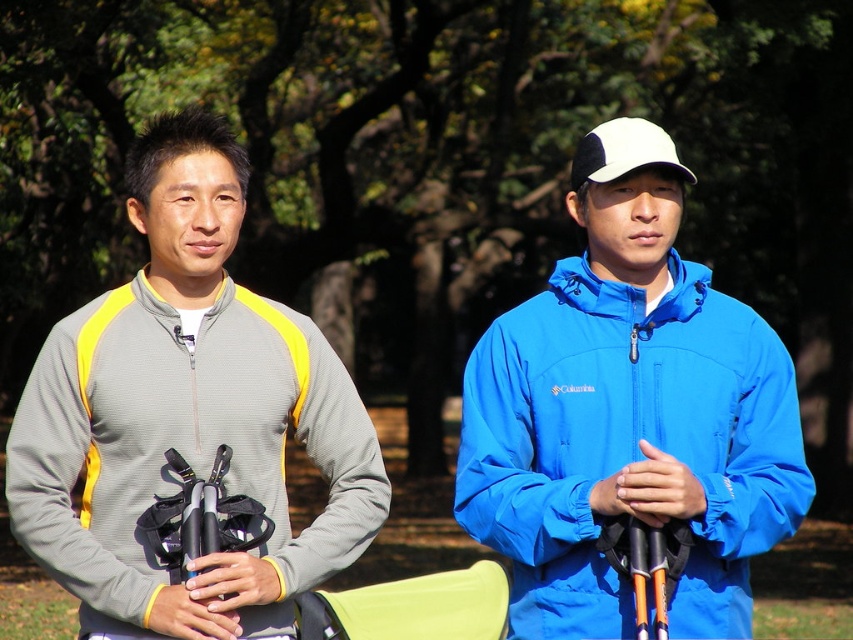
Can you confirm if blue matte jacket at center is thinner than gray fleece jacket at left?

Yes.

Between blue matte jacket at center and gray fleece jacket at left, which one has less height?

blue matte jacket at center

Is point (550, 380) more distant than point (245, 621)?

No, (550, 380) is closer to viewer.

Where is `blue matte jacket at center`? blue matte jacket at center is located at coordinates (628, 413).